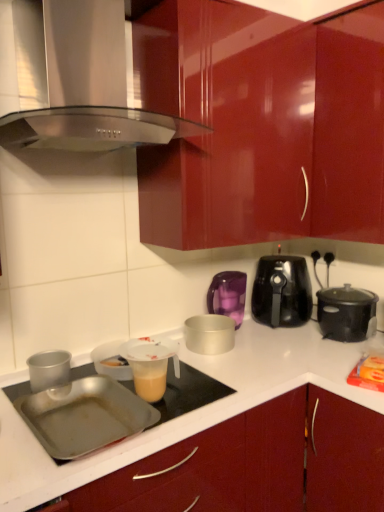
Question: Which direction should I rotate to look at matte silver container at center, which is counted as the third kitchen appliance, starting from the left?

Choices:
 (A) right
 (B) left

Answer: (A)

Question: From the image's perspective, is silver metallic pot at center, the 4th kitchen appliance positioned from the right, under black plastic air fryer at center right, which is the 2th kitchen appliance from right to left?

Choices:
 (A) yes
 (B) no

Answer: (A)

Question: Can you confirm if silver metallic pot at center, the 4th kitchen appliance positioned from the right, is positioned to the left of black plastic air fryer at center right, which is the 4th kitchen appliance in left-to-right order?

Choices:
 (A) no
 (B) yes

Answer: (B)

Question: From a real-world perspective, is silver metallic pot at center, the 4th kitchen appliance positioned from the right, positioned under black plastic air fryer at center right, which is the 4th kitchen appliance in left-to-right order, based on gravity?

Choices:
 (A) no
 (B) yes

Answer: (B)

Question: From the image's perspective, is silver metallic pot at center, the 4th kitchen appliance positioned from the right, above black plastic air fryer at center right, which is the 2th kitchen appliance from right to left?

Choices:
 (A) yes
 (B) no

Answer: (B)

Question: Considering the relative sizes of silver metallic pot at center, acting as the second kitchen appliance starting from the left, and black plastic air fryer at center right, which is the 2th kitchen appliance from right to left, in the image provided, is silver metallic pot at center, acting as the second kitchen appliance starting from the left, shorter than black plastic air fryer at center right, which is the 2th kitchen appliance from right to left,?

Choices:
 (A) no
 (B) yes

Answer: (B)

Question: Does silver metallic pot at center, acting as the second kitchen appliance starting from the left, have a lesser width compared to black plastic air fryer at center right, which is the 4th kitchen appliance in left-to-right order?

Choices:
 (A) yes
 (B) no

Answer: (A)

Question: From a real-world perspective, is stainless steel range hood at upper center on top of metallic silver pan at lower left?

Choices:
 (A) yes
 (B) no

Answer: (A)

Question: Considering the relative positions of stainless steel range hood at upper center and metallic silver pan at lower left in the image provided, is stainless steel range hood at upper center to the right of metallic silver pan at lower left from the viewer's perspective?

Choices:
 (A) no
 (B) yes

Answer: (A)

Question: Does stainless steel range hood at upper center have a smaller size compared to metallic silver pan at lower left?

Choices:
 (A) yes
 (B) no

Answer: (B)

Question: Considering the relative positions of stainless steel range hood at upper center and metallic silver pan at lower left in the image provided, is stainless steel range hood at upper center to the left of metallic silver pan at lower left from the viewer's perspective?

Choices:
 (A) yes
 (B) no

Answer: (A)

Question: Is stainless steel range hood at upper center taller than metallic silver pan at lower left?

Choices:
 (A) yes
 (B) no

Answer: (A)

Question: Considering the relative sizes of stainless steel range hood at upper center and metallic silver pan at lower left in the image provided, is stainless steel range hood at upper center shorter than metallic silver pan at lower left?

Choices:
 (A) yes
 (B) no

Answer: (B)

Question: Are matte silver container at center, which ranks as the third kitchen appliance in right-to-left order, and silver metallic pot at center, the 4th kitchen appliance positioned from the right, making contact?

Choices:
 (A) yes
 (B) no

Answer: (B)